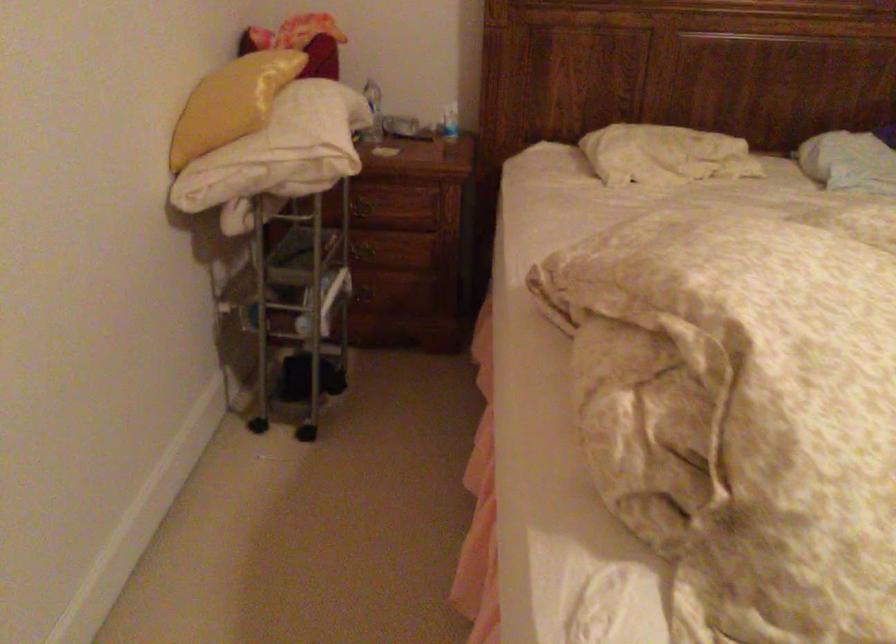
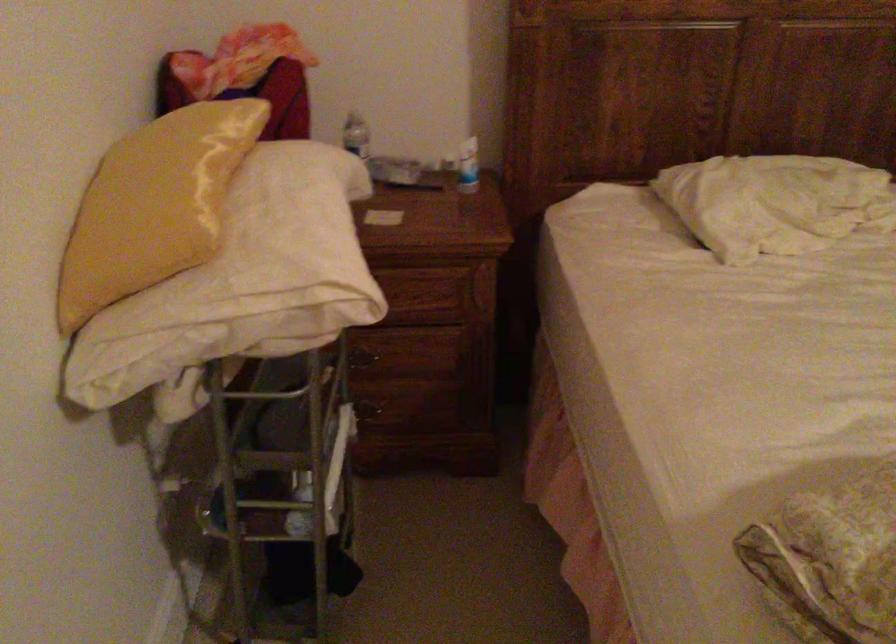
Question: The camera is either moving clockwise (left) or counter-clockwise (right) around the object. The first image is from the beginning of the video and the second image is from the end. Is the camera moving left or right when shooting the video?

Choices:
 (A) Left
 (B) Right

Answer: (A)